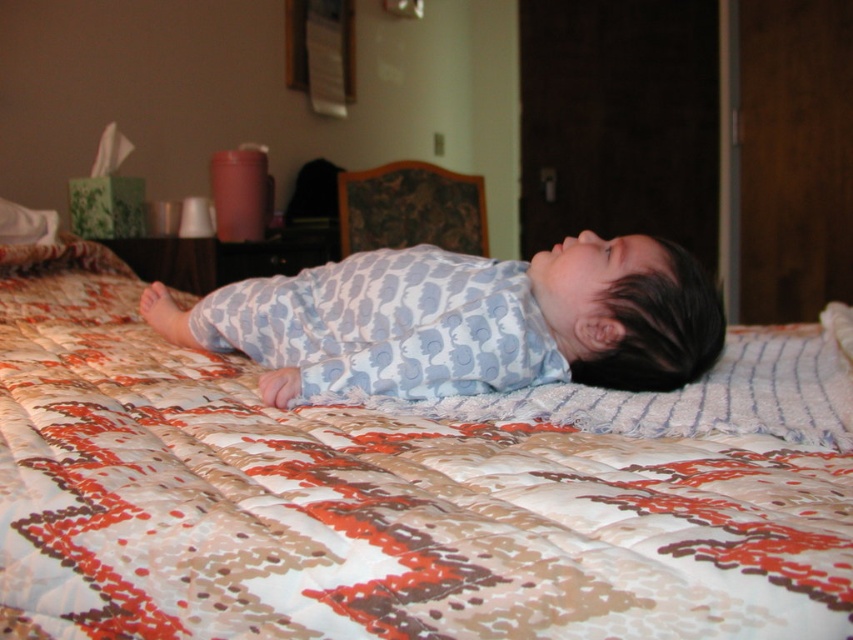
Can you confirm if printed cotton quilt at center is positioned to the right of blue cotton onesie at center?

In fact, printed cotton quilt at center is to the left of blue cotton onesie at center.

Is printed cotton quilt at center closer to camera compared to blue cotton onesie at center?

Yes, printed cotton quilt at center is closer to the viewer.

Find the location of a particular element. This screenshot has height=640, width=853. printed cotton quilt at center is located at coordinates (367, 502).

This screenshot has width=853, height=640. In order to click on printed cotton quilt at center in this screenshot , I will do `click(367, 502)`.